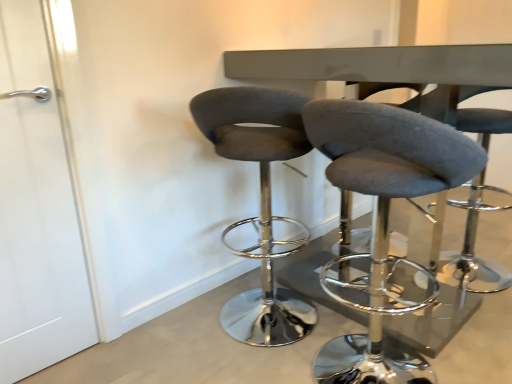
Question: Is gray fabric stool at center, the second chair when ordered from left to right, not near white matte door at left?

Choices:
 (A) yes
 (B) no

Answer: (A)

Question: Considering the relative sizes of gray fabric stool at center, positioned as the 2th chair in right-to-left order, and white matte door at left in the image provided, is gray fabric stool at center, positioned as the 2th chair in right-to-left order, bigger than white matte door at left?

Choices:
 (A) yes
 (B) no

Answer: (A)

Question: Is gray fabric stool at center, the second chair when ordered from left to right, wider than white matte door at left?

Choices:
 (A) yes
 (B) no

Answer: (A)

Question: Considering the relative sizes of gray fabric stool at center, the second chair when ordered from left to right, and white matte door at left in the image provided, is gray fabric stool at center, the second chair when ordered from left to right, smaller than white matte door at left?

Choices:
 (A) no
 (B) yes

Answer: (A)

Question: Is white matte door at left inside gray fabric stool at center, the second chair when ordered from left to right?

Choices:
 (A) no
 (B) yes

Answer: (A)

Question: Is white matte door at left situated inside metallic gray table at center or outside?

Choices:
 (A) outside
 (B) inside

Answer: (A)

Question: In terms of size, does white matte door at left appear bigger or smaller than metallic gray table at center?

Choices:
 (A) big
 (B) small

Answer: (B)

Question: Is point (22, 175) positioned closer to the camera than point (422, 77)?

Choices:
 (A) farther
 (B) closer

Answer: (A)

Question: In the image, is white matte door at left on the left side or the right side of metallic gray table at center?

Choices:
 (A) right
 (B) left

Answer: (B)

Question: Considering the positions of gray fabric stool at center, the second chair when ordered from left to right, and white matte door at left in the image, is gray fabric stool at center, the second chair when ordered from left to right, taller or shorter than white matte door at left?

Choices:
 (A) tall
 (B) short

Answer: (B)

Question: Considering the positions of gray fabric stool at center, the second chair when ordered from left to right, and white matte door at left in the image, is gray fabric stool at center, the second chair when ordered from left to right, bigger or smaller than white matte door at left?

Choices:
 (A) small
 (B) big

Answer: (B)

Question: From a real-world perspective, relative to white matte door at left, is gray fabric stool at center, the second chair when ordered from left to right, vertically above or below?

Choices:
 (A) below
 (B) above

Answer: (A)

Question: Does point (335, 114) appear closer or farther from the camera than point (49, 190)?

Choices:
 (A) closer
 (B) farther

Answer: (A)

Question: From a real-world perspective, relative to metallic gray table at center, is velvet grey stool at center, which is the 1th chair in right-to-left order, vertically above or below?

Choices:
 (A) above
 (B) below

Answer: (B)

Question: Is point (473, 286) closer or farther from the camera than point (335, 77)?

Choices:
 (A) closer
 (B) farther

Answer: (B)